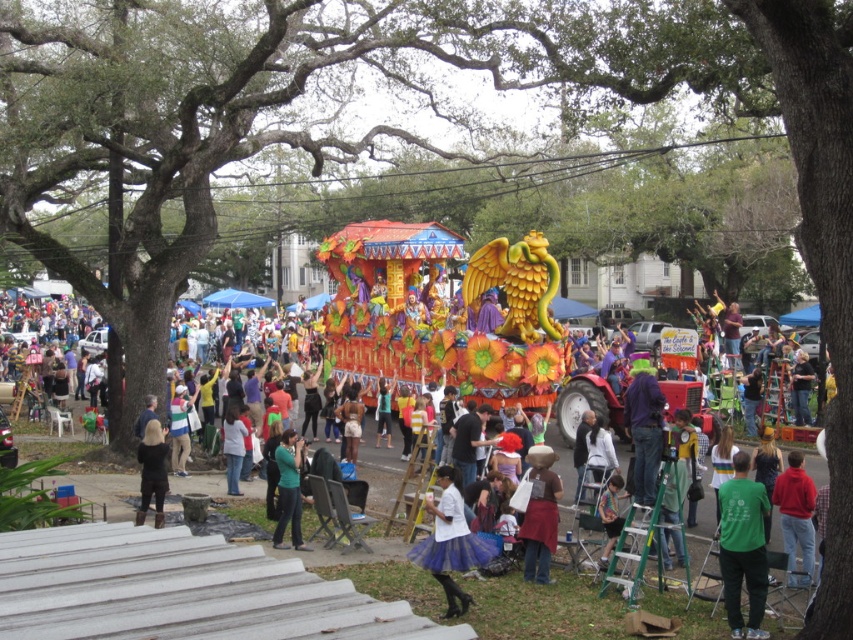
You are a photographer standing at the edge of the crowd. You want to capture a photo that includes both the white cotton shirt at center and the black fabric at lower left. Given that your camera has a maximum focus range of 20 meters, will you be able to include both in the same frame without moving closer?

The white cotton shirt at center and black fabric at lower left are 21.76 meters apart from each other. Since the distance exceeds the camera s maximum focus range of 20 meters, you won t be able to include both in the same frame without moving closer.

You are a photographer trying to capture the float in the center of the image. You notice two items in your frame, the white cotton shirt at center and the black fabric at lower left. Which item should you focus on to ensure the float remains in the background?

The white cotton shirt at center is closer to the viewer than the black fabric at lower left. To keep the float in the background, focus on the white cotton shirt at center so the float stays behind it.

From the picture: You are a photographer at the event and want to capture a photo of the green matte shirt at center and the black fabric at lower left. Which object should you zoom in on to get a clearer image of its details?

The green matte shirt at center is thinner than the black fabric at lower left, so you should zoom in on the green matte shirt at center to capture its details more clearly.